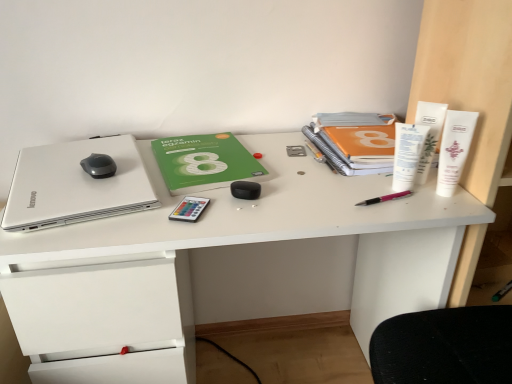
You are a GUI agent. You are given a task and a screenshot of the screen. Output one action in this format:
    pyautogui.click(x=<x>, y=<y>)
    Task: Click on the vacant area on top of white matte desk at center (from a real-world perspective)
    This screenshot has height=384, width=512.
    Given the screenshot: What is the action you would take?
    pyautogui.click(x=198, y=173)